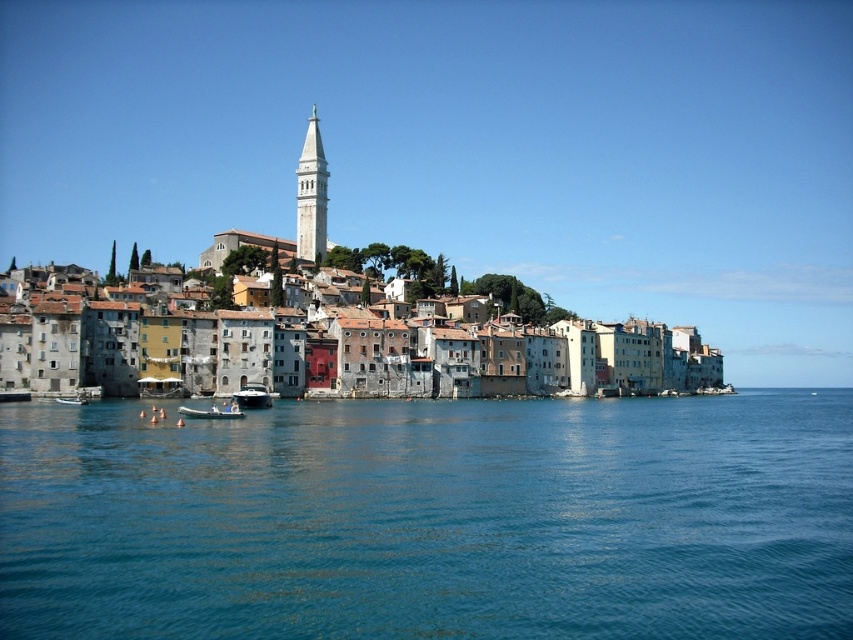
You are a tourist standing on the dock and see the blue water at center and the white plastic boat at lower left. Which object appears taller from your perspective?

The blue water at center appears taller than the white plastic boat at lower left because it is much taller as described.

You are standing at the waterfront in the coastal town and want to take a photo of the white bell tower. There is a point at coordinates point (836, 429) that is 293.18 feet away from you. If you walk towards this point, will you get closer to the white bell tower?

The point at coordinates point (836, 429) is 293.18 feet away from the camera. Walking towards this point would mean moving closer to it, but since the white bell tower is a separate structure, its distance from you depends on its location relative to the point. However, based on the given information, we cannot determine if moving to the point brings you closer to the tower. More details about the tower and point positions are needed.

You are a tourist standing at the edge of the coastal town, looking out at the waterfront. You notice a point marked at coordinates (311, 195). What significant structure does this point mark?

The point marked at coordinates (311, 195) indicates the location of the white stone bell tower at upper center.